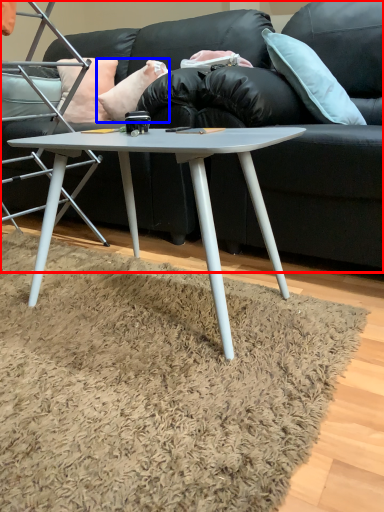
Question: Which object appears closest to the camera in this image, studio couch (highlighted by a red box) or pillow (highlighted by a blue box)?

Choices:
 (A) studio couch
 (B) pillow

Answer: (A)